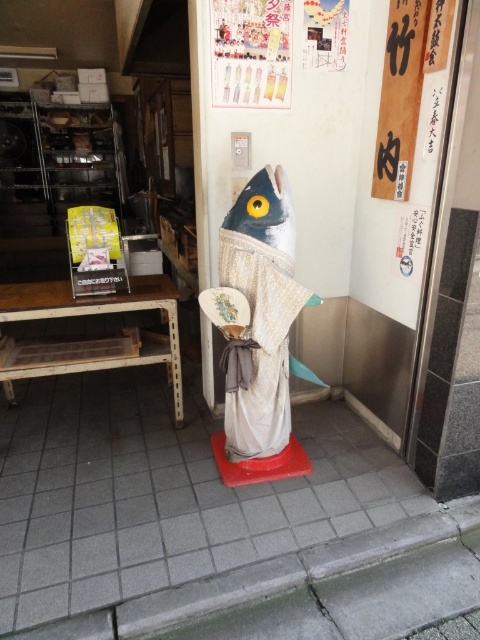
Question: Is gray tile pavement at center thinner than matte white fish at center?

Choices:
 (A) no
 (B) yes

Answer: (A)

Question: Can you confirm if gray tile pavement at center is wider than wooden sign at upper right?

Choices:
 (A) no
 (B) yes

Answer: (B)

Question: Which of these objects is positioned closest to the wooden sign at upper right?

Choices:
 (A) matte white fish at center
 (B) gray tile pavement at center

Answer: (A)

Question: Which object appears farthest from the camera in this image?

Choices:
 (A) wooden sign at upper right
 (B) matte white fish at center

Answer: (B)

Question: Is gray tile pavement at center wider than matte white fish at center?

Choices:
 (A) no
 (B) yes

Answer: (B)

Question: Which object appears farthest from the camera in this image?

Choices:
 (A) matte white fish at center
 (B) gray tile pavement at center
 (C) wooden sign at upper right

Answer: (A)